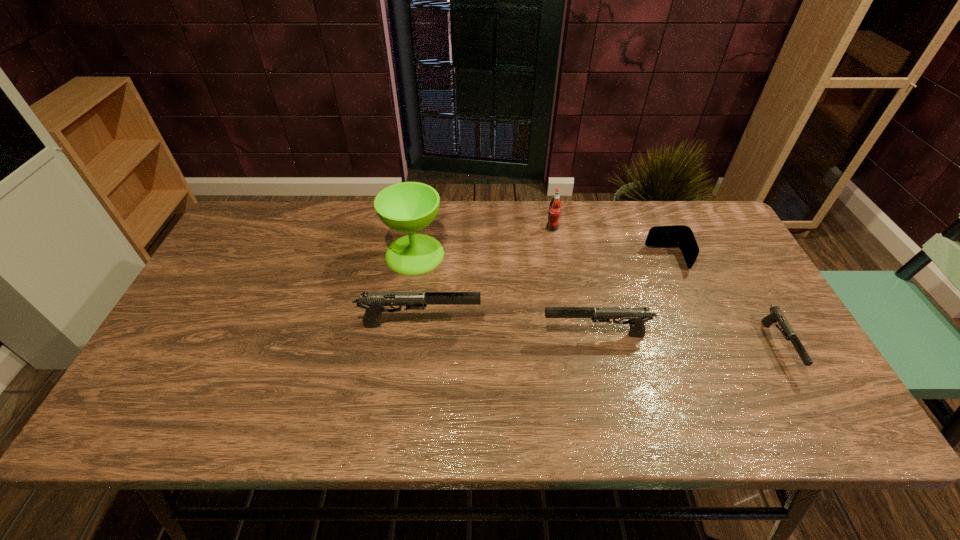
Find the location of a particular element. This screenshot has height=540, width=960. the fifth closest object to the second object from right to left is located at coordinates (408, 207).

Where is `object that is the third nearest to the second tallest object`? Image resolution: width=960 pixels, height=540 pixels. object that is the third nearest to the second tallest object is located at coordinates (637, 316).

Locate which gun is the closest to the soda bottle. Please provide its 2D coordinates. Your answer should be formatted as a tuple, i.e. [(x, y)], where the tuple contains the x and y coordinates of a point satisfying the conditions above.

[(637, 316)]

In order to click on gun that is the second nearest to the shortest gun in this screenshot , I will do `click(374, 302)`.